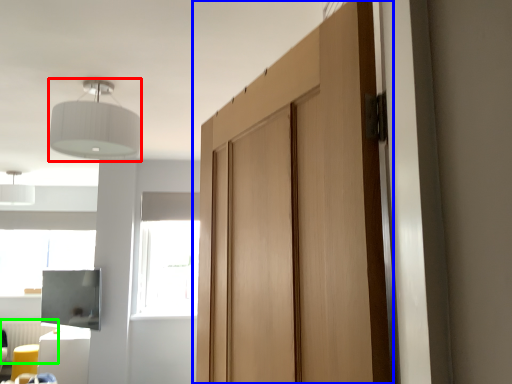
Question: Which is farther away from light fixture (highlighted by a red box)? door (highlighted by a blue box) or radiator (highlighted by a green box)?

Choices:
 (A) door
 (B) radiator

Answer: (B)